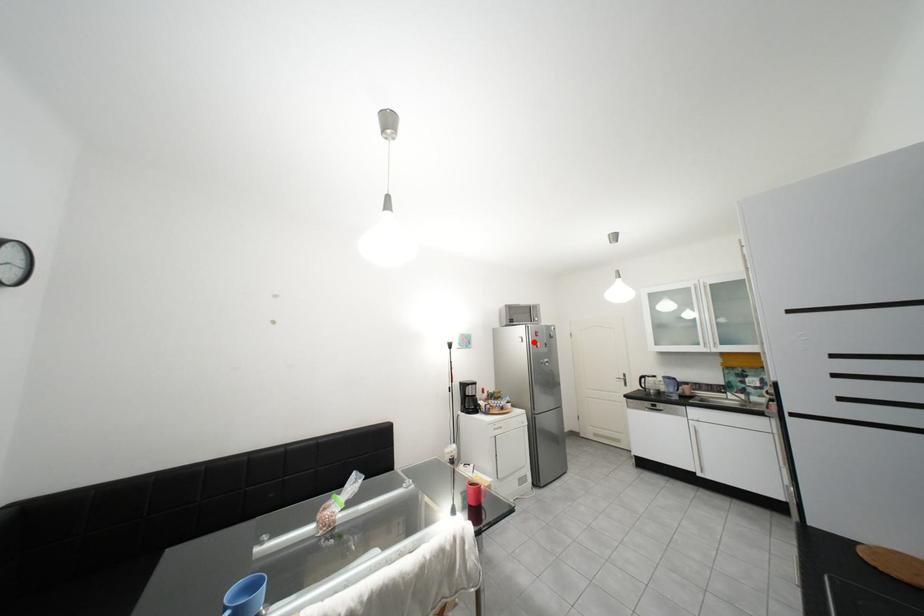
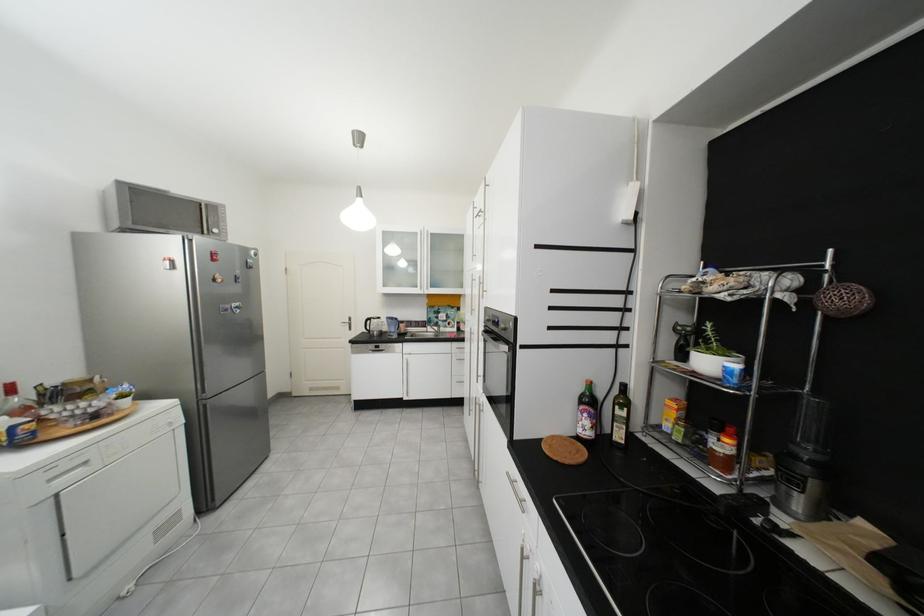
Find the pixel in the second image that matches the highlighted location in the first image.

(185, 269)